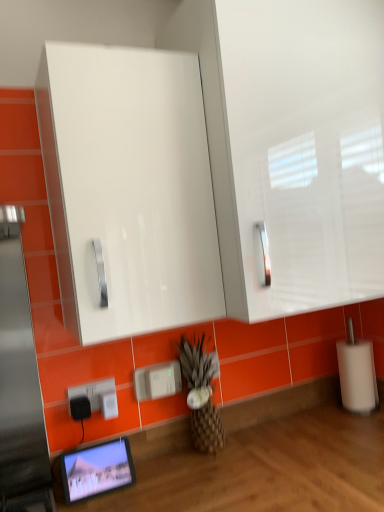
The width and height of the screenshot is (384, 512). Find the location of `white plastic electric outlet at lower left, which is the second electric outlet in right-to-left order`. white plastic electric outlet at lower left, which is the second electric outlet in right-to-left order is located at coordinates (109, 404).

Find the location of a particular element. This screenshot has height=512, width=384. white plastic charger at lower center, which is the first electric outlet from right to left is located at coordinates (157, 381).

This screenshot has width=384, height=512. I want to click on burlap textured pineapple at center, so click(x=201, y=395).

Find the location of a particular element. The width and height of the screenshot is (384, 512). white glossy cabinet at upper center is located at coordinates (128, 189).

Find the location of a particular element. The image size is (384, 512). white plastic electric outlet at lower left, the 3th electric outlet positioned from the right is located at coordinates (96, 397).

You are a GUI agent. You are given a task and a screenshot of the screen. Output one action in this format:
    pyautogui.click(x=<x>, y=<y>)
    Task: Click on the white plastic electric outlet at lower left, which is the second electric outlet in right-to-left order
    This screenshot has width=384, height=512.
    Given the screenshot: What is the action you would take?
    pyautogui.click(x=109, y=404)

Where is `the 2nd electric outlet behind the white glossy cabinet at upper center, starting your count from the anchor`? Image resolution: width=384 pixels, height=512 pixels. the 2nd electric outlet behind the white glossy cabinet at upper center, starting your count from the anchor is located at coordinates (96, 397).

Which of these two, white plastic electric outlet at lower left, positioned as the 2th electric outlet in left-to-right order, or white glossy cabinet at upper center, stands taller?

Standing taller between the two is white glossy cabinet at upper center.

From a real-world perspective, is white plastic electric outlet at lower left, the 3th electric outlet positioned from the right, positioned under white glossy cabinet at upper center based on gravity?

Yes, from a real-world perspective, white plastic electric outlet at lower left, the 3th electric outlet positioned from the right, is under white glossy cabinet at upper center.

Do you think white plastic electric outlet at lower left, the 3th electric outlet positioned from the right, is within white glossy cabinet at upper center, or outside of it?

white plastic electric outlet at lower left, the 3th electric outlet positioned from the right, is outside white glossy cabinet at upper center.

Does white plastic electric outlet at lower left, which is the second electric outlet in right-to-left order, touch white glossy cabinet at upper center?

No, white plastic electric outlet at lower left, which is the second electric outlet in right-to-left order, is not with white glossy cabinet at upper center.

You are a GUI agent. You are given a task and a screenshot of the screen. Output one action in this format:
    pyautogui.click(x=<x>, y=<y>)
    Task: Click on the 3rd electric outlet behind the white glossy cabinet at upper center, starting your count from the anchor
    
    Given the screenshot: What is the action you would take?
    pyautogui.click(x=109, y=404)

Is white plastic electric outlet at lower left, which is the third electric outlet in left-to-right order, not within white glossy cabinet at upper center?

Yes, white plastic electric outlet at lower left, which is the third electric outlet in left-to-right order, is outside of white glossy cabinet at upper center.

From the image's perspective, does black plastic electric outlet at lower left, which is the 4th electric outlet from right to left, appear higher than white plastic charger at lower center, which is the first electric outlet from right to left?

No.

Is black plastic electric outlet at lower left, which is the 1th electric outlet from left to right, beside white plastic charger at lower center, which is the first electric outlet from right to left?

black plastic electric outlet at lower left, which is the 1th electric outlet from left to right, and white plastic charger at lower center, which is the first electric outlet from right to left, are clearly separated.

Does black plastic electric outlet at lower left, which is the 1th electric outlet from left to right, have a smaller size compared to white plastic charger at lower center, the 4th electric outlet in the left-to-right sequence?

Yes, black plastic electric outlet at lower left, which is the 1th electric outlet from left to right, is smaller than white plastic charger at lower center, the 4th electric outlet in the left-to-right sequence.

Is black plastic electric outlet at lower left, which is the 4th electric outlet from right to left, facing towards white plastic charger at lower center, which is the first electric outlet from right to left?

No, black plastic electric outlet at lower left, which is the 4th electric outlet from right to left, is not turned towards white plastic charger at lower center, which is the first electric outlet from right to left.

Is point (211, 446) closer to camera compared to point (81, 394)?

No, it is behind (81, 394).

How many degrees apart are the facing directions of burlap textured pineapple at center and white plastic electric outlet at lower left, the 3th electric outlet positioned from the right?

0.0192 degrees separate the facing orientations of burlap textured pineapple at center and white plastic electric outlet at lower left, the 3th electric outlet positioned from the right.

Which is in front, burlap textured pineapple at center or white plastic electric outlet at lower left, positioned as the 2th electric outlet in left-to-right order?

white plastic electric outlet at lower left, positioned as the 2th electric outlet in left-to-right order, is more forward.

In the image, is burlap textured pineapple at center on the left side or the right side of white plastic electric outlet at lower left, the 3th electric outlet positioned from the right?

burlap textured pineapple at center is to the right of white plastic electric outlet at lower left, the 3th electric outlet positioned from the right.

Can you confirm if black plastic electric outlet at lower left, which is the 1th electric outlet from left to right, is wider than matte black tablet at lower left?

Incorrect, the width of black plastic electric outlet at lower left, which is the 1th electric outlet from left to right, does not surpass that of matte black tablet at lower left.

In the scene shown: Can you confirm if black plastic electric outlet at lower left, which is the 1th electric outlet from left to right, is smaller than matte black tablet at lower left?

Yes, black plastic electric outlet at lower left, which is the 1th electric outlet from left to right, is smaller than matte black tablet at lower left.

From a real-world perspective, who is located higher, black plastic electric outlet at lower left, which is the 1th electric outlet from left to right, or matte black tablet at lower left?

From a 3D spatial view, black plastic electric outlet at lower left, which is the 1th electric outlet from left to right, is above.

How many degrees apart are the facing directions of black plastic electric outlet at lower left, which is the 4th electric outlet from right to left, and matte black tablet at lower left?

The angle between the facing direction of black plastic electric outlet at lower left, which is the 4th electric outlet from right to left, and the facing direction of matte black tablet at lower left is 0.00207 degrees.

Is point (178, 387) positioned behind point (73, 471)?

Yes, point (178, 387) is behind point (73, 471).

In the image, is white plastic charger at lower center, the 4th electric outlet in the left-to-right sequence, positioned in front of or behind matte black tablet at lower left?

Clearly, white plastic charger at lower center, the 4th electric outlet in the left-to-right sequence, is behind matte black tablet at lower left.

Consider the image. Which is more to the right, white plastic charger at lower center, the 4th electric outlet in the left-to-right sequence, or matte black tablet at lower left?

Positioned to the right is white plastic charger at lower center, the 4th electric outlet in the left-to-right sequence.

Choose the correct answer: Is white plastic charger at lower center, the 4th electric outlet in the left-to-right sequence, inside matte black tablet at lower left or outside it?

white plastic charger at lower center, the 4th electric outlet in the left-to-right sequence, exists outside the volume of matte black tablet at lower left.

From a real-world perspective, is white glossy cabinet at upper center located higher than white plastic electric outlet at lower left, which is the second electric outlet in right-to-left order?

Yes, from a real-world perspective, white glossy cabinet at upper center is above white plastic electric outlet at lower left, which is the second electric outlet in right-to-left order.

Considering their positions, is white glossy cabinet at upper center located in front of or behind white plastic electric outlet at lower left, which is the third electric outlet in left-to-right order?

In the image, white glossy cabinet at upper center appears in front of white plastic electric outlet at lower left, which is the third electric outlet in left-to-right order.

Between white glossy cabinet at upper center and white plastic electric outlet at lower left, which is the second electric outlet in right-to-left order, which one has smaller width?

Thinner between the two is white plastic electric outlet at lower left, which is the second electric outlet in right-to-left order.

Based on the photo, is white glossy cabinet at upper center not close to white plastic electric outlet at lower left, which is the third electric outlet in left-to-right order?

No, white glossy cabinet at upper center is not far from white plastic electric outlet at lower left, which is the third electric outlet in left-to-right order.

The width and height of the screenshot is (384, 512). I want to click on electric outlet that is the 2nd object directly below the white glossy cabinet at upper center (from a real-world perspective), so click(x=96, y=397).

At what (x,y) coordinates should I click in order to perform the action: click on glass door that appears on the right of white plastic electric outlet at lower left, which is the second electric outlet in right-to-left order. Please return your answer as a coordinate pair (x, y). Looking at the image, I should click on (128, 189).

From the image, which object appears to be nearer to black plastic electric outlet at lower left, which is the 1th electric outlet from left to right, white plastic charger at lower center, the 4th electric outlet in the left-to-right sequence, or burlap textured pineapple at center?

white plastic charger at lower center, the 4th electric outlet in the left-to-right sequence, lies closer to black plastic electric outlet at lower left, which is the 1th electric outlet from left to right, than the other object.

Estimate the real-world distances between objects in this image. Which object is closer to black plastic electric outlet at lower left, which is the 4th electric outlet from right to left, white plastic electric outlet at lower left, which is the second electric outlet in right-to-left order, or white plastic charger at lower center, the 4th electric outlet in the left-to-right sequence?

The object closer to black plastic electric outlet at lower left, which is the 4th electric outlet from right to left, is white plastic electric outlet at lower left, which is the second electric outlet in right-to-left order.

From the image, which object appears to be nearer to white plastic electric outlet at lower left, positioned as the 2th electric outlet in left-to-right order, matte black tablet at lower left or white glossy cabinet at upper center?

The object closer to white plastic electric outlet at lower left, positioned as the 2th electric outlet in left-to-right order, is matte black tablet at lower left.

Looking at the image, which one is located closer to burlap textured pineapple at center, white plastic electric outlet at lower left, the 3th electric outlet positioned from the right, or white plastic charger at lower center, the 4th electric outlet in the left-to-right sequence?

Based on the image, white plastic charger at lower center, the 4th electric outlet in the left-to-right sequence, appears to be nearer to burlap textured pineapple at center.

Based on their spatial positions, is burlap textured pineapple at center or white glossy cabinet at upper center further from matte black tablet at lower left?

white glossy cabinet at upper center.

Which object lies nearer to the anchor point black plastic electric outlet at lower left, which is the 4th electric outlet from right to left, white glossy cabinet at upper center or burlap textured pineapple at center?

Based on the image, burlap textured pineapple at center appears to be nearer to black plastic electric outlet at lower left, which is the 4th electric outlet from right to left.

Based on their spatial positions, is black plastic electric outlet at lower left, which is the 4th electric outlet from right to left, or white plastic charger at lower center, which is the first electric outlet from right to left, closer to white plastic electric outlet at lower left, which is the third electric outlet in left-to-right order?

Based on the image, black plastic electric outlet at lower left, which is the 4th electric outlet from right to left, appears to be nearer to white plastic electric outlet at lower left, which is the third electric outlet in left-to-right order.

From the image, which object appears to be nearer to white glossy cabinet at upper center, white plastic electric outlet at lower left, positioned as the 2th electric outlet in left-to-right order, or burlap textured pineapple at center?

Among the two, burlap textured pineapple at center is located nearer to white glossy cabinet at upper center.

I want to click on electric outlet situated between white plastic electric outlet at lower left, which is the third electric outlet in left-to-right order, and burlap textured pineapple at center from left to right, so click(157, 381).

I want to click on pineapple between white glossy cabinet at upper center and black plastic electric outlet at lower left, which is the 1th electric outlet from left to right, in the up-down direction, so click(201, 395).

At what (x,y) coordinates should I click in order to perform the action: click on computer monitor situated between black plastic electric outlet at lower left, which is the 1th electric outlet from left to right, and burlap textured pineapple at center from left to right. Please return your answer as a coordinate pair (x, y). The width and height of the screenshot is (384, 512). Looking at the image, I should click on (97, 470).

This screenshot has width=384, height=512. Identify the location of electric outlet situated between black plastic electric outlet at lower left, which is the 4th electric outlet from right to left, and white plastic electric outlet at lower left, which is the second electric outlet in right-to-left order, from left to right. (96, 397).